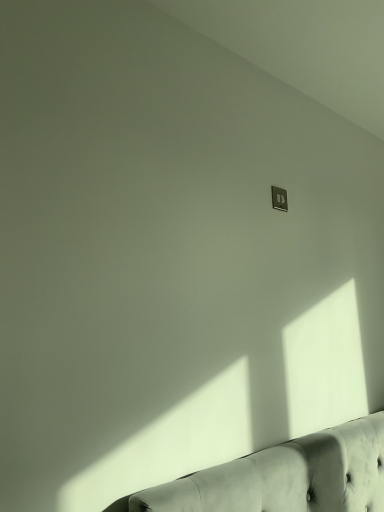
Question: Is tufted leather couch at lower right taller than metallic silver outlet at upper right?

Choices:
 (A) no
 (B) yes

Answer: (A)

Question: Considering the relative positions of tufted leather couch at lower right and metallic silver outlet at upper right in the image provided, is tufted leather couch at lower right behind metallic silver outlet at upper right?

Choices:
 (A) yes
 (B) no

Answer: (B)

Question: Does tufted leather couch at lower right come in front of metallic silver outlet at upper right?

Choices:
 (A) yes
 (B) no

Answer: (A)

Question: Is tufted leather couch at lower right not within metallic silver outlet at upper right?

Choices:
 (A) yes
 (B) no

Answer: (A)

Question: Can you confirm if tufted leather couch at lower right is positioned to the left of metallic silver outlet at upper right?

Choices:
 (A) no
 (B) yes

Answer: (A)

Question: Does tufted leather couch at lower right have a lesser width compared to metallic silver outlet at upper right?

Choices:
 (A) no
 (B) yes

Answer: (A)

Question: Are metallic silver outlet at upper right and tufted leather couch at lower right located far from each other?

Choices:
 (A) no
 (B) yes

Answer: (A)

Question: From a real-world perspective, does metallic silver outlet at upper right stand above tufted leather couch at lower right?

Choices:
 (A) no
 (B) yes

Answer: (B)

Question: Does metallic silver outlet at upper right appear on the right side of tufted leather couch at lower right?

Choices:
 (A) yes
 (B) no

Answer: (B)

Question: Does metallic silver outlet at upper right have a lesser width compared to tufted leather couch at lower right?

Choices:
 (A) no
 (B) yes

Answer: (B)

Question: Is metallic silver outlet at upper right to the left of tufted leather couch at lower right from the viewer's perspective?

Choices:
 (A) yes
 (B) no

Answer: (A)

Question: Is metallic silver outlet at upper right smaller than tufted leather couch at lower right?

Choices:
 (A) no
 (B) yes

Answer: (B)

Question: In terms of width, does tufted leather couch at lower right look wider or thinner when compared to metallic silver outlet at upper right?

Choices:
 (A) wide
 (B) thin

Answer: (A)